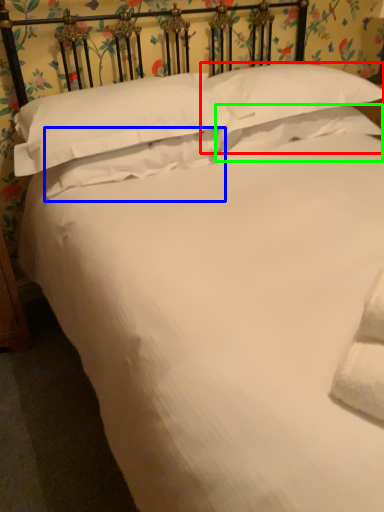
Question: Considering the real-world distances, which object is closest to pillow (highlighted by a red box)? pillow (highlighted by a blue box) or pillow (highlighted by a green box).

Choices:
 (A) pillow
 (B) pillow

Answer: (B)